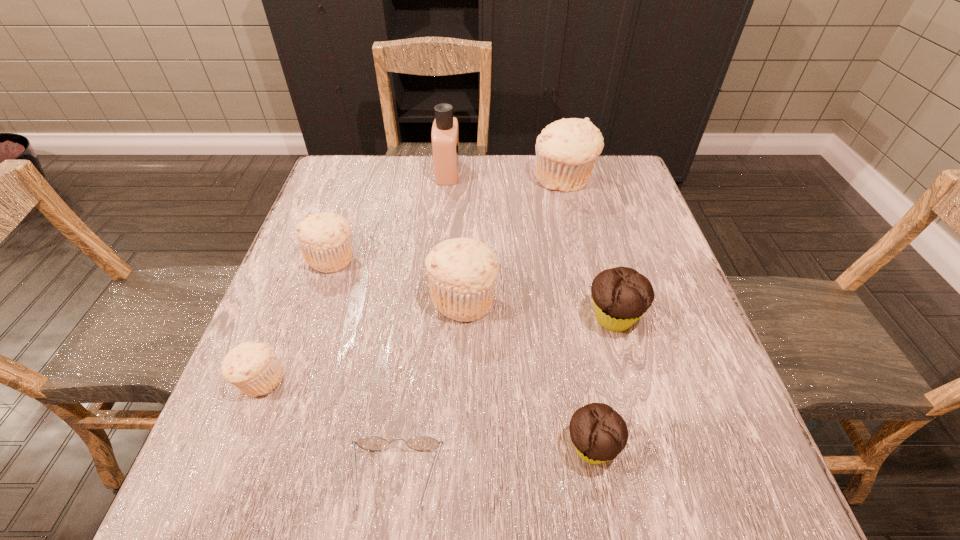
Locate an element on the screen. This screenshot has width=960, height=540. perfume positioned at the far edge is located at coordinates (445, 133).

In order to click on muffin that is at the far edge in this screenshot , I will do `click(566, 150)`.

Identify the location of muffin that is at the near edge. (599, 433).

I want to click on spectacles that is at the near edge, so click(x=371, y=443).

The height and width of the screenshot is (540, 960). What are the coordinates of `object situated at the far right corner` in the screenshot? It's located at (566, 150).

In order to click on vacant area at the far edge of the desktop in this screenshot , I will do `click(478, 186)`.

At what (x,y) coordinates should I click in order to perform the action: click on vacant space at the near edge of the desktop. Please return your answer as a coordinate pair (x, y). This screenshot has height=540, width=960. Looking at the image, I should click on (452, 494).

What are the coordinates of `vacant region at the left edge` in the screenshot? It's located at tap(282, 452).

In the image, there is a desktop. Where is `blank space at the right edge`? The image size is (960, 540). blank space at the right edge is located at coordinates (622, 234).

Find the location of `vacant region at the far left corner`. vacant region at the far left corner is located at coordinates (331, 195).